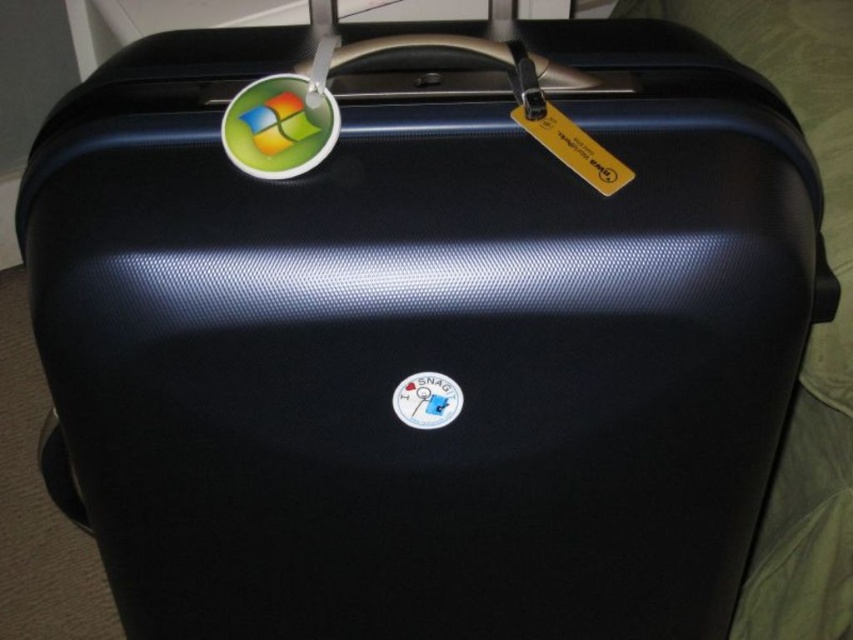
Can you confirm if shiny plastic sticker at top left is taller than yellow paper tag at upper center?

Yes, shiny plastic sticker at top left is taller than yellow paper tag at upper center.

In the scene shown: Which is more to the left, shiny plastic sticker at top left or yellow paper tag at upper center?

From the viewer's perspective, shiny plastic sticker at top left appears more on the left side.

What do you see at coordinates (279, 128) in the screenshot? The width and height of the screenshot is (853, 640). I see `shiny plastic sticker at top left` at bounding box center [279, 128].

The image size is (853, 640). What are the coordinates of `shiny plastic sticker at top left` in the screenshot? It's located at (279, 128).

Between point (585, 161) and point (397, 401), which one is positioned behind?

Positioned behind is point (397, 401).

Can you confirm if yellow paper tag at upper center is bigger than white matte sticker at center?

Correct, yellow paper tag at upper center is larger in size than white matte sticker at center.

Does point (607, 188) lie in front of point (412, 412)?

That is True.

In order to click on yellow paper tag at upper center in this screenshot , I will do (572, 145).

This screenshot has height=640, width=853. I want to click on shiny plastic sticker at top left, so click(279, 128).

Who is taller, shiny plastic sticker at top left or white matte sticker at center?

With more height is shiny plastic sticker at top left.

Does point (267, 124) come behind point (436, 406)?

No.

At what (x,y) coordinates should I click in order to perform the action: click on shiny plastic sticker at top left. Please return your answer as a coordinate pair (x, y). The width and height of the screenshot is (853, 640). Looking at the image, I should click on (279, 128).